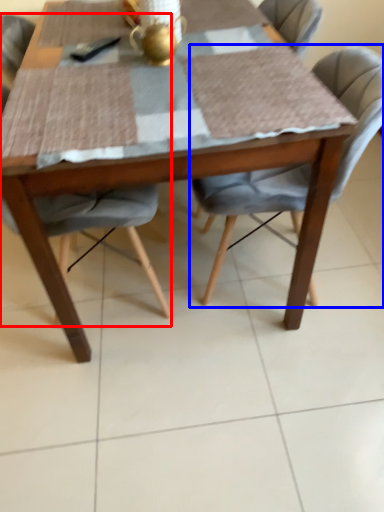
Question: Which point is further to the camera, chair (highlighted by a red box) or chair (highlighted by a blue box)?

Choices:
 (A) chair
 (B) chair

Answer: (B)